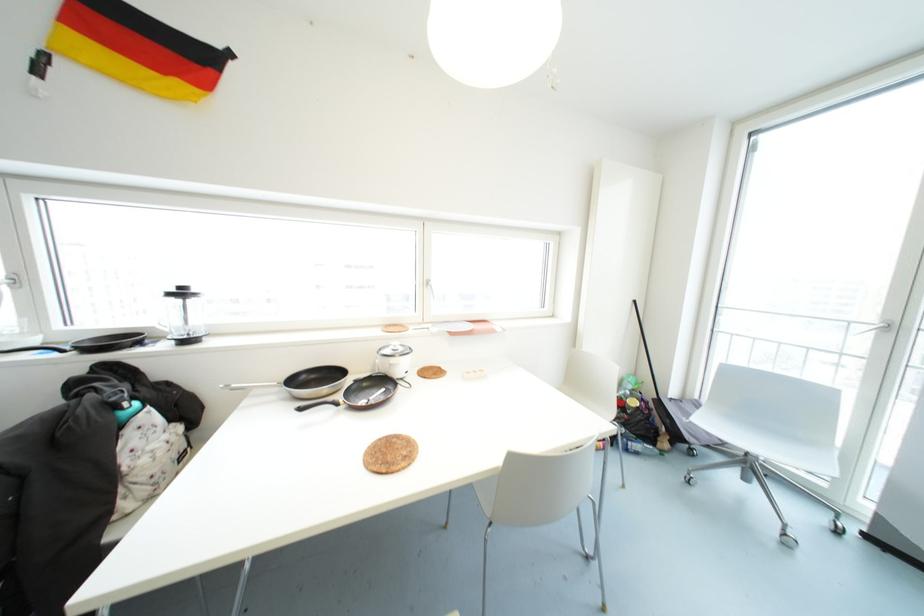
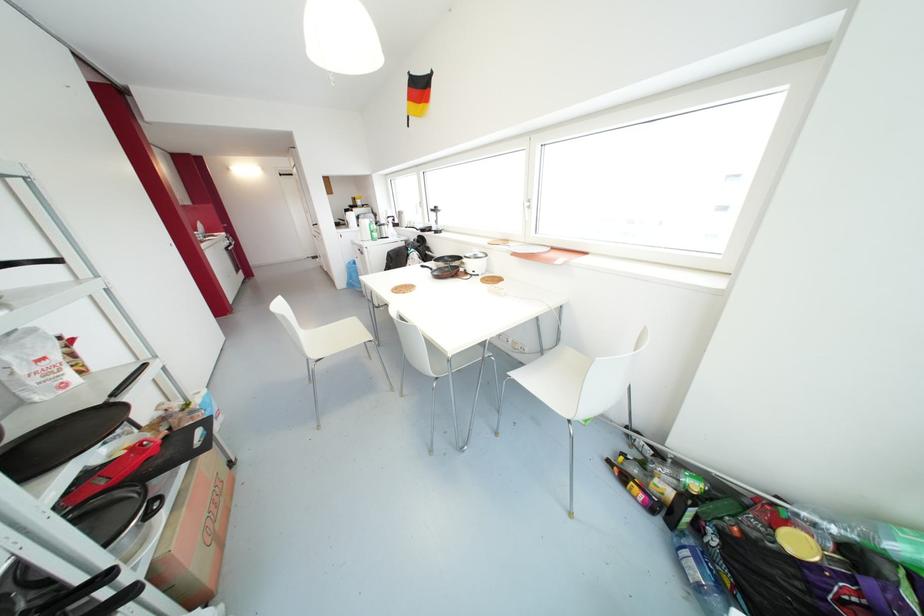
In the second image, find the point that corresponds to [300,408] in the first image.

(421, 265)